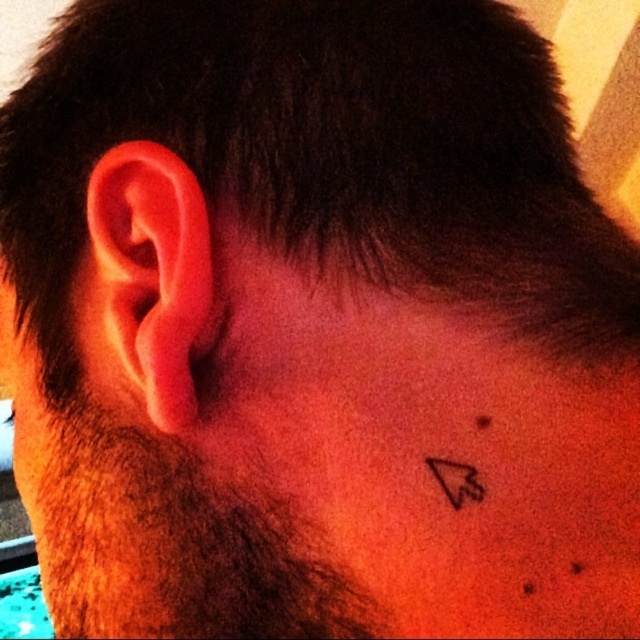
Does pink flesh-colored ear at left appear on the right side of black ink tattoo at lower center?

In fact, pink flesh-colored ear at left is to the left of black ink tattoo at lower center.

Where is `pink flesh-colored ear at left`? The height and width of the screenshot is (640, 640). pink flesh-colored ear at left is located at coordinates 145,284.

Find the location of `pink flesh-colored ear at left`. pink flesh-colored ear at left is located at coordinates (145, 284).